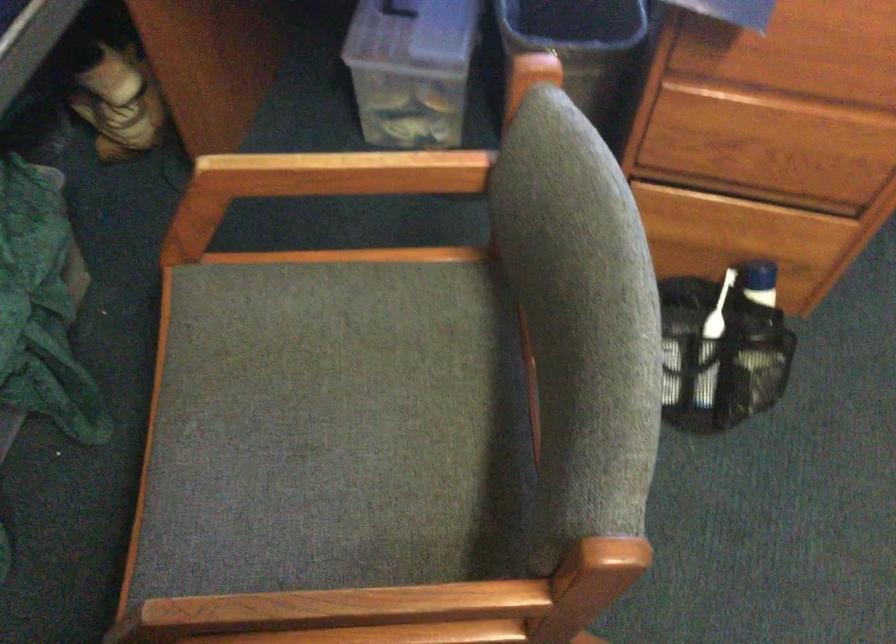
The width and height of the screenshot is (896, 644). Find the location of `clear plastic bin`. clear plastic bin is located at coordinates (410, 70).